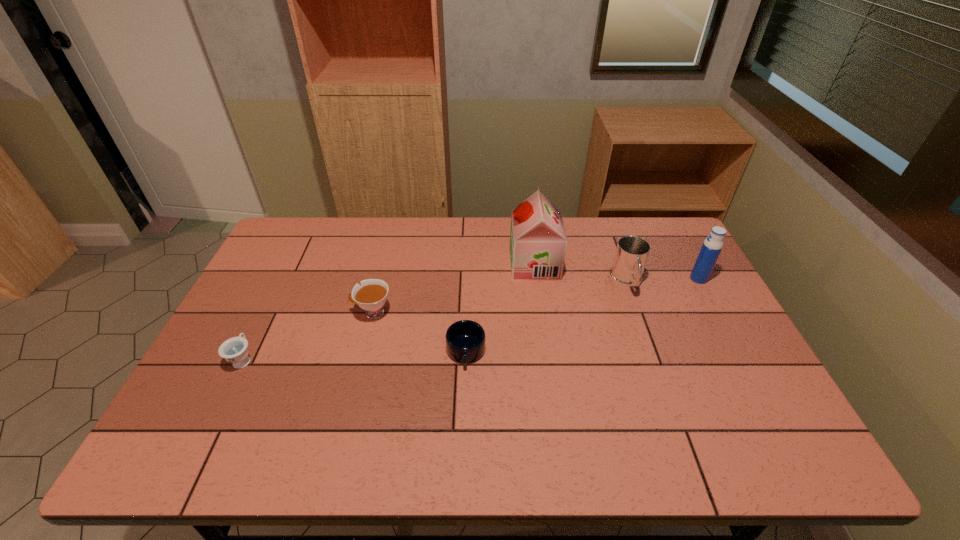
This screenshot has height=540, width=960. I want to click on vacant space in between the left mug and the fourth object from left to right, so click(x=500, y=308).

The image size is (960, 540). What are the coordinates of `empty location between the right teacup and the right mug` in the screenshot? It's located at (499, 299).

Where is `the second closest object relative to the right teacup`? the second closest object relative to the right teacup is located at coordinates click(x=235, y=350).

This screenshot has width=960, height=540. In order to click on the fifth closest object to the shorter mug in this screenshot , I will do `click(713, 244)`.

Identify the location of vacant space that satisfies the following two spatial constraints: 1. with the cap open on the tallest object; 2. with the handle on the side of the nearer mug. The image size is (960, 540). (546, 352).

The width and height of the screenshot is (960, 540). Find the location of `free spot that satisfies the following two spatial constraints: 1. with the cap open on the soya milk; 2. with the handle on the side of the third object from left to right`. free spot that satisfies the following two spatial constraints: 1. with the cap open on the soya milk; 2. with the handle on the side of the third object from left to right is located at coordinates (546, 352).

Image resolution: width=960 pixels, height=540 pixels. What are the coordinates of `vacant area that satisfies the following two spatial constraints: 1. with the cap open on the fourth object from left to right; 2. with the handle on the side of the shorter mug` in the screenshot? It's located at (546, 352).

Where is `free space that satisfies the following two spatial constraints: 1. on the back side of the rightmost object; 2. with the cap open on the tallest object`? free space that satisfies the following two spatial constraints: 1. on the back side of the rightmost object; 2. with the cap open on the tallest object is located at coordinates (691, 265).

Locate an element on the screen. Image resolution: width=960 pixels, height=540 pixels. vacant area that satisfies the following two spatial constraints: 1. on the back side of the water bottle; 2. with the cap open on the tallest object is located at coordinates (691, 265).